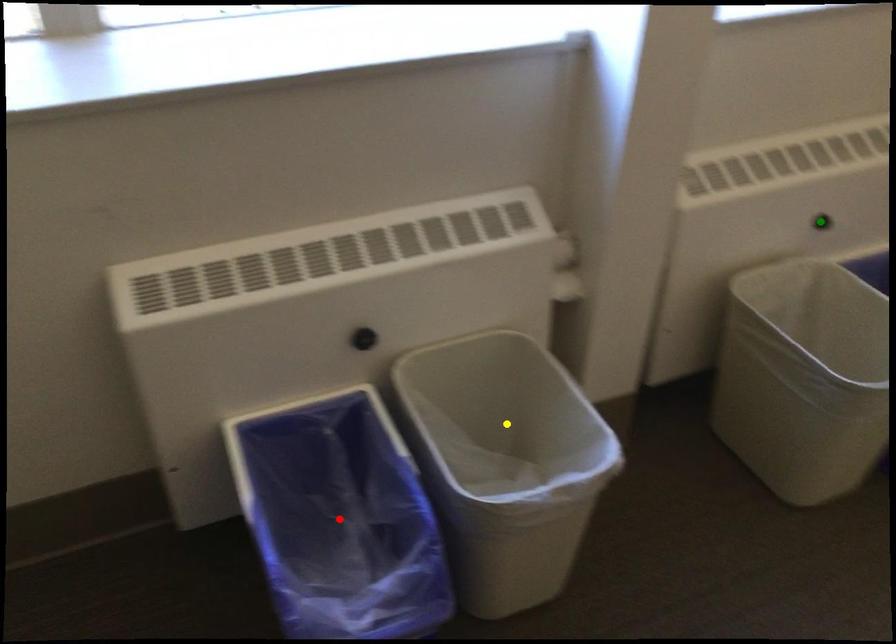
In the scene shown: Order these from nearest to farthest:
red point
green point
yellow point

1. red point
2. yellow point
3. green point